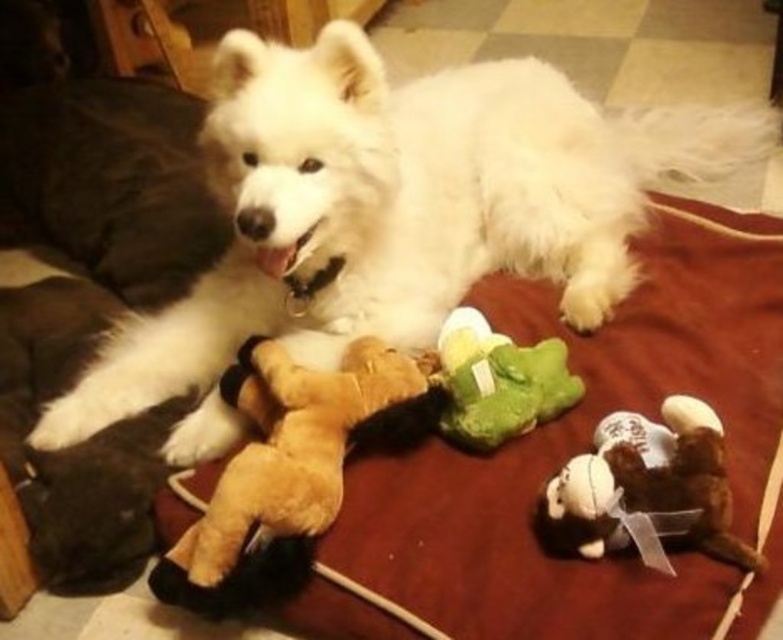
Question: Is white fluffy dog at upper center smaller than green plush frog at center?

Choices:
 (A) no
 (B) yes

Answer: (A)

Question: Is white fluffy dog at upper center behind brown plush bear at lower right?

Choices:
 (A) no
 (B) yes

Answer: (B)

Question: Which point is farther to the camera?

Choices:
 (A) white fluffy dog at upper center
 (B) brown plush bear at lower right

Answer: (A)

Question: Which point is farther from the camera taking this photo?

Choices:
 (A) (284, 218)
 (B) (302, 412)
 (C) (478, 314)
 (D) (655, 520)

Answer: (C)

Question: Is brown plush bear at lower left further to camera compared to green plush frog at center?

Choices:
 (A) yes
 (B) no

Answer: (B)

Question: Among these points, which one is nearest to the camera?

Choices:
 (A) (686, 461)
 (B) (319, 38)
 (C) (456, 342)
 (D) (392, 426)

Answer: (A)